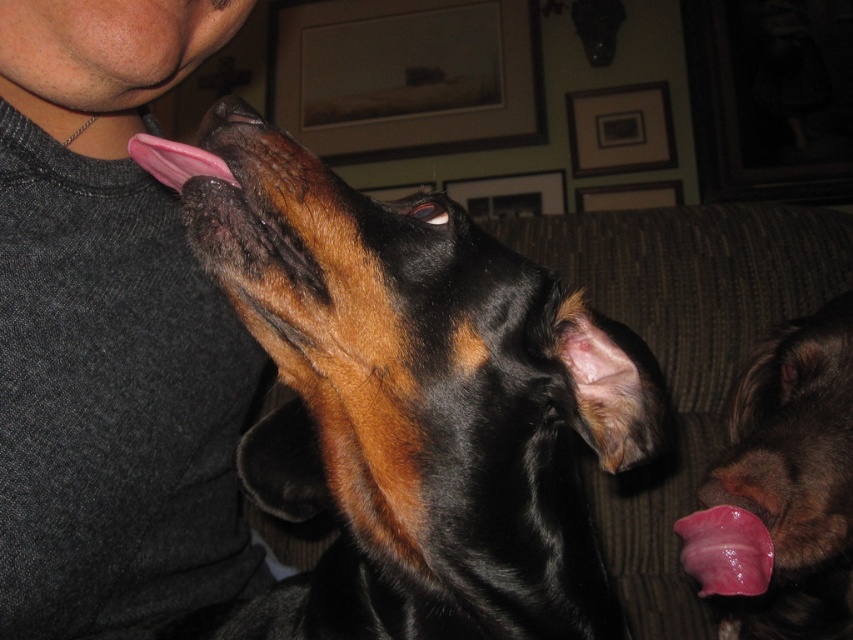
The image size is (853, 640). I want to click on black shiny fur at upper center, so click(418, 408).

Is point (804, 422) behind point (695, 512)?

Yes.

At what (x,y) coordinates should I click in order to perform the action: click on pink glossy tongue at lower right. Please return your answer as a coordinate pair (x, y). This screenshot has height=640, width=853. Looking at the image, I should click on (782, 490).

This screenshot has width=853, height=640. I want to click on pink glossy tongue at lower right, so click(x=782, y=490).

Which is in front, point (764, 344) or point (250, 108)?

Point (250, 108) is in front.

Does point (688, 568) come closer to viewer compared to point (253, 113)?

No, it is not.

Locate an element on the screen. The height and width of the screenshot is (640, 853). pink glossy tongue at lower right is located at coordinates (782, 490).